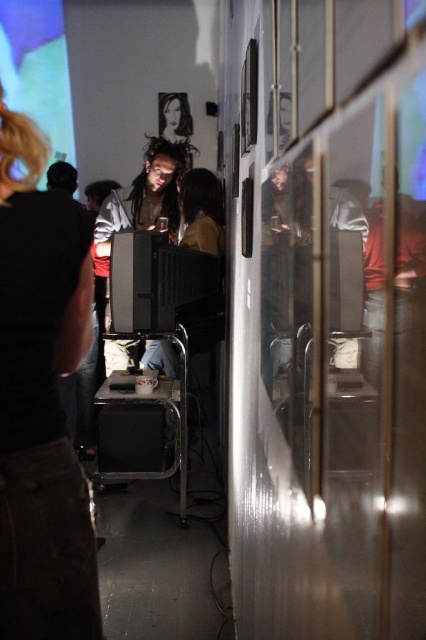
Question: Does black matte shirt at left appear on the left side of black plastic stool at center?

Choices:
 (A) yes
 (B) no

Answer: (B)

Question: Is black matte shirt at left positioned behind matte black screen at upper left?

Choices:
 (A) yes
 (B) no

Answer: (B)

Question: Estimate the real-world distances between objects in this image. Which object is farther from the black plastic stool at center?

Choices:
 (A) matte black screen at upper left
 (B) black matte shirt at left

Answer: (A)

Question: Which of the following is the farthest from the observer?

Choices:
 (A) (13, 83)
 (B) (80, 580)

Answer: (A)

Question: Does matte black screen at upper left appear over black plastic stool at center?

Choices:
 (A) yes
 (B) no

Answer: (A)

Question: Estimate the real-world distances between objects in this image. Which object is closer to the black plastic stool at center?

Choices:
 (A) matte black screen at upper left
 (B) black matte shirt at left

Answer: (B)